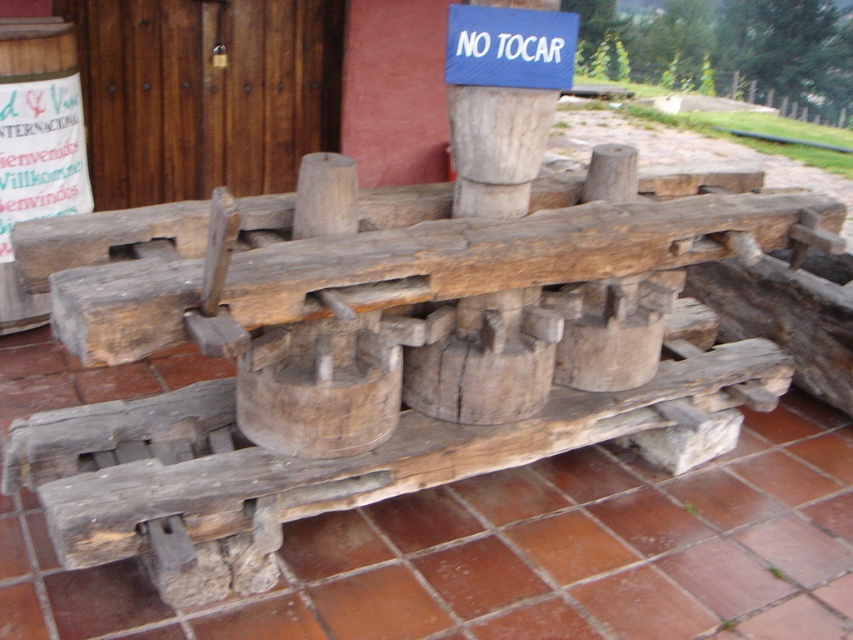
Does wooden post at center have a greater width compared to blue fabric sign at upper center?

No, wooden post at center is not wider than blue fabric sign at upper center.

Which is in front, point (480, 131) or point (569, 76)?

Positioned in front is point (569, 76).

Locate an element on the screen. wooden post at center is located at coordinates (496, 147).